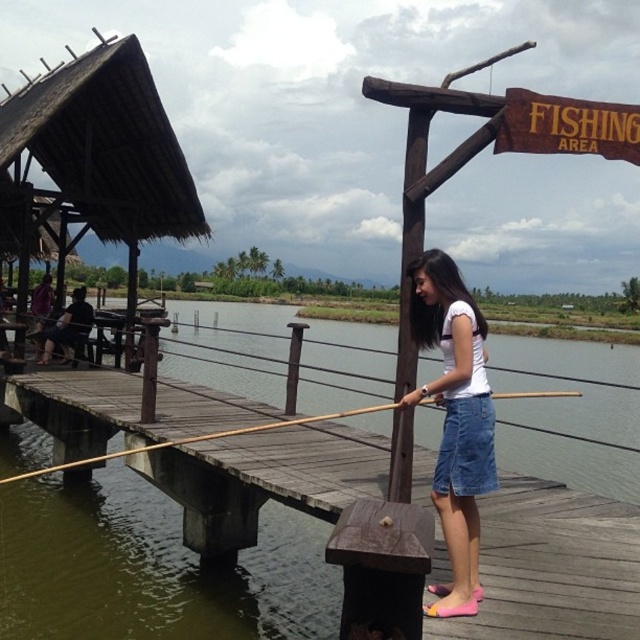
Locate an element on the screen. This screenshot has height=640, width=640. denim skirt at center is located at coordinates tap(454, 420).

Can you confirm if denim skirt at center is positioned to the right of brown wooden fishing pole at center?

No, denim skirt at center is not to the right of brown wooden fishing pole at center.

Where is `denim skirt at center`? denim skirt at center is located at coordinates (454, 420).

This screenshot has height=640, width=640. What are the coordinates of `denim skirt at center` in the screenshot? It's located at [454, 420].